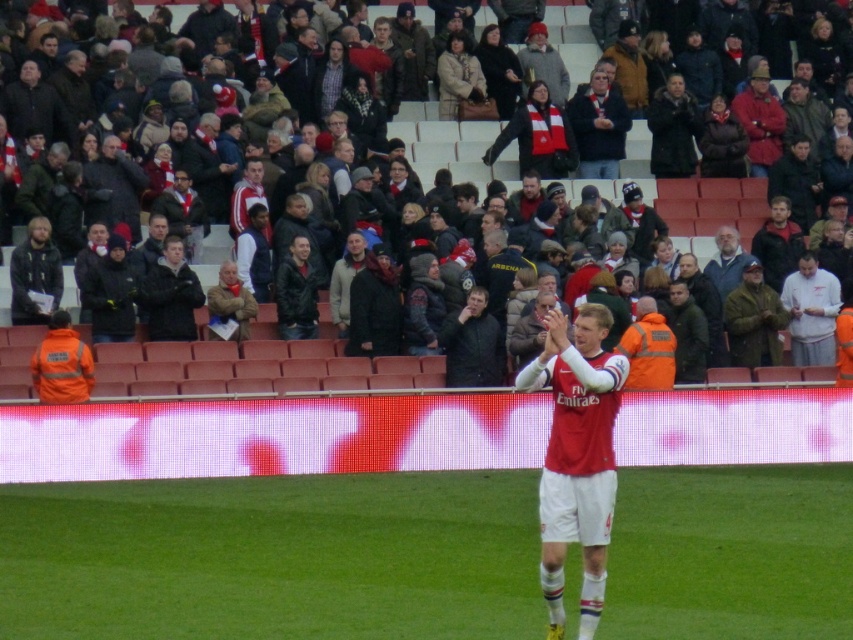
Looking at this image, you are a photographer standing at the edge of the field. You want to take a photo that includes both the green grass at center and the white fabric shirt at right. What is the minimum distance you need to move backward to ensure both objects are fully visible in your frame?

The green grass at center is 6.96 meters from the white fabric shirt at right. To capture both in your frame, you need to move backward at least 6.96 meters from the closest object to ensure both are within the camera view.

You are a photographer trying to capture a shot of the green grass at center and the dark gray jacket at upper center from the player wearing the red jersey with

The green grass at center is not as tall as the dark gray jacket at upper center, so the grass will appear shorter in the photo compared to the jacket.

You are a photographer trying to capture a shot of the dark gray jacket at upper center from a position near the edge of the field. Given that the field is at the bottom of the image and the stands are above, would you need to adjust your camera angle upwards or downwards to frame the jacket properly?

The dark gray jacket at upper center is located at point [456,150], which is in the upper part of the image. To frame it properly from the field edge, you would need to adjust your camera angle upwards since the jacket is positioned higher than the field level.